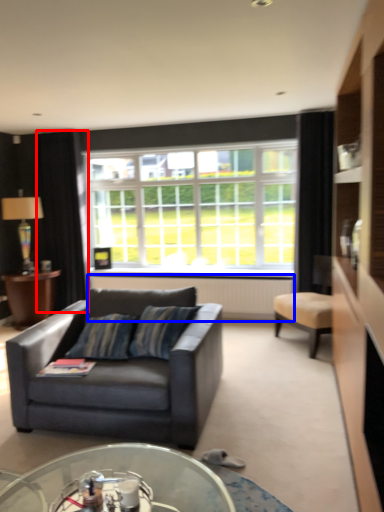
Question: Among these objects, which one is farthest to the camera, curtain (highlighted by a red box) or radiator (highlighted by a blue box)?

Choices:
 (A) curtain
 (B) radiator

Answer: (A)